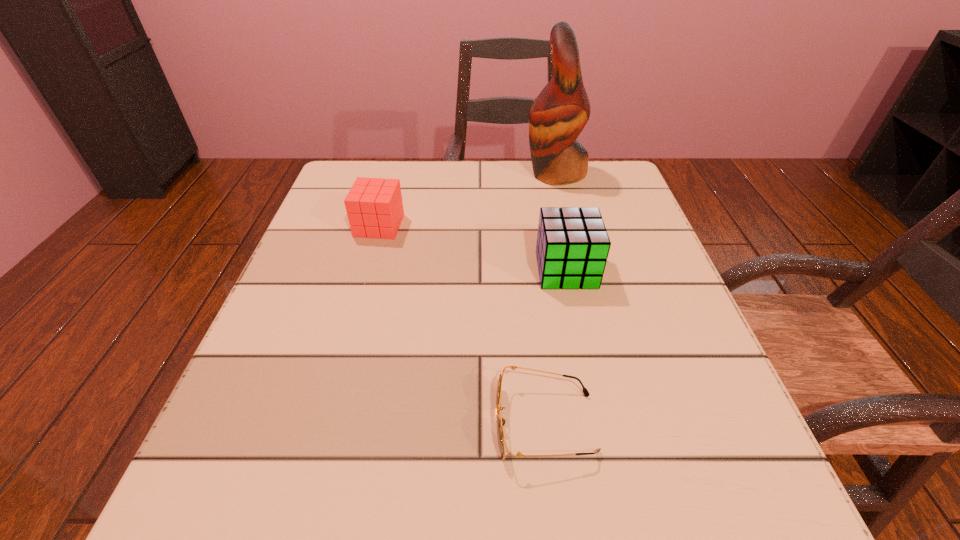
Find the location of a particular element. This screenshot has height=540, width=960. free area in between the right cube and the sunglasses is located at coordinates (556, 347).

I want to click on object that is the second closest to the shortest object, so click(374, 207).

At what (x,y) coordinates should I click in order to perform the action: click on object that is the second closest to the right cube. Please return your answer as a coordinate pair (x, y). The image size is (960, 540). Looking at the image, I should click on (558, 115).

What are the coordinates of `vacant space that satisfies the following two spatial constraints: 1. on the front side of the third shortest object; 2. on the left side of the second farthest object` in the screenshot? It's located at (367, 270).